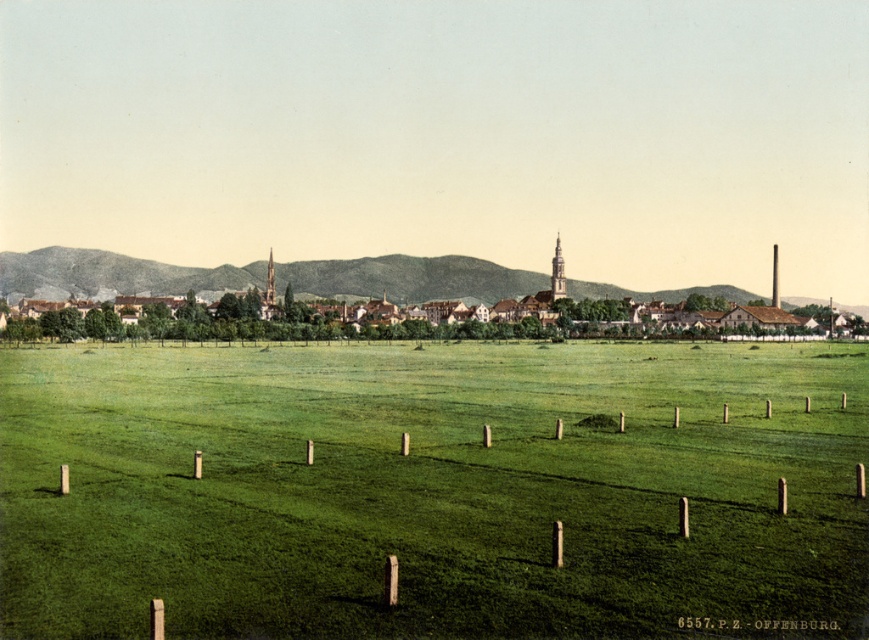
You are a visitor in the town and want to take a photo of the brown wooden houses at center and the brown wooden posts at lower center. Which object appears wider in the photo?

The brown wooden houses at center appears wider than the brown wooden posts at lower center because the brown wooden houses at center has a greater width than the brown wooden posts at lower center.

You are standing in the town square and want to take a photo of both point (499, 600) and point (200, 269) in the foreground. Which point should you focus on first to ensure both are in focus?

You should focus on point (499, 600) first because it is closer to the camera than point (200, 269). By focusing on the closer point, the farther point will also be in focus due to the depth of field.